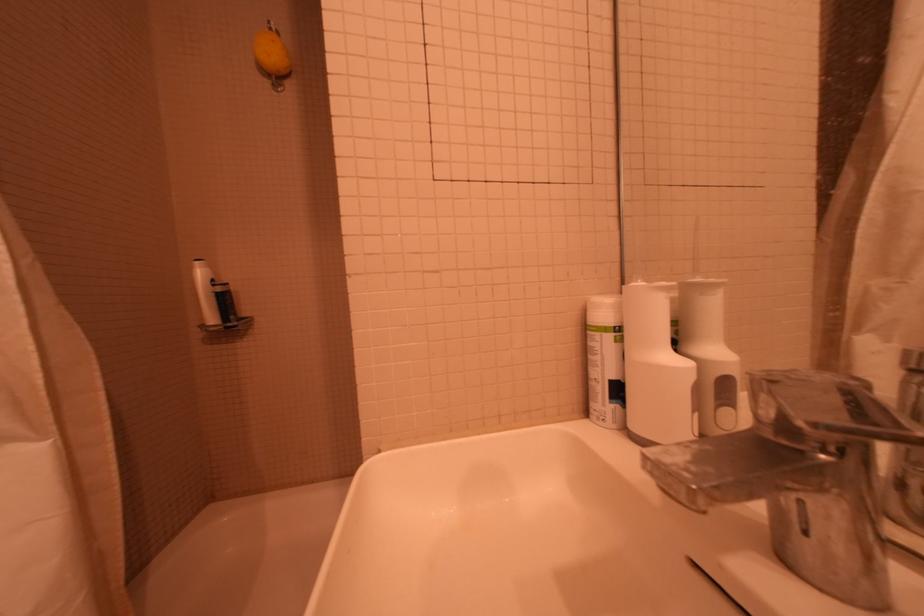
Identify the location of white spray can. (604, 361).